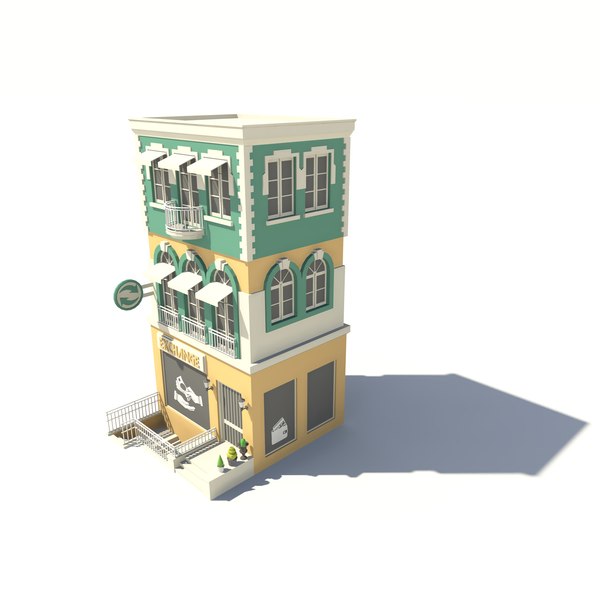
Locate an element on the screen. This screenshot has width=600, height=600. first floor is located at coordinates (203, 393).